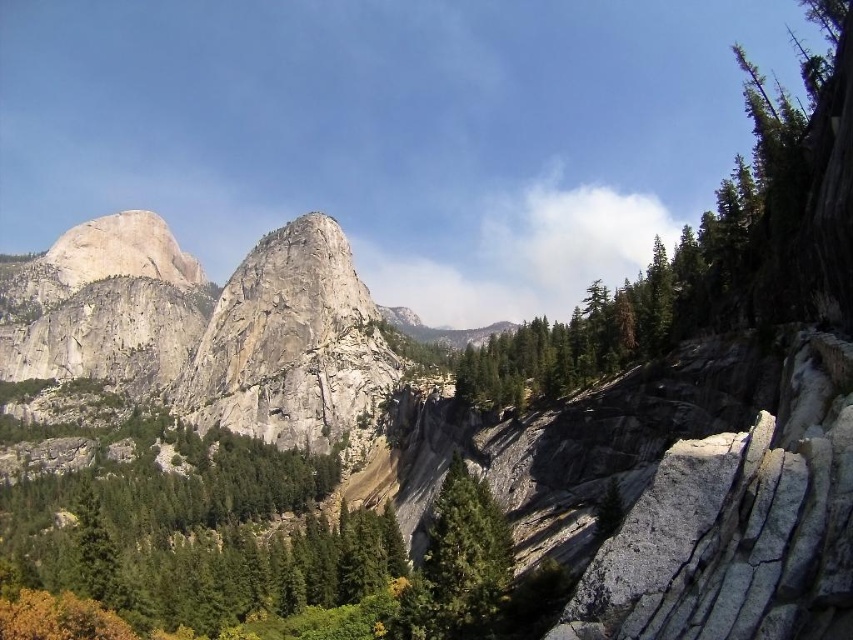
Question: Can you confirm if green textured rock at upper right is positioned to the right of gray/rough rock formation at center?

Choices:
 (A) yes
 (B) no

Answer: (A)

Question: Can you confirm if gray/rough rock formation at center is positioned below green textured tree at center?

Choices:
 (A) yes
 (B) no

Answer: (B)

Question: Which point is farther to the camera?

Choices:
 (A) gray/rough rock formation at center
 (B) green textured rock at upper right

Answer: (A)

Question: Which point is closer to the camera?

Choices:
 (A) 448,484
 (B) 505,397

Answer: (A)

Question: Among these objects, which one is nearest to the camera?

Choices:
 (A) green textured tree at center
 (B) gray/rough rock formation at center
 (C) green textured rock at upper right

Answer: (A)

Question: Is green textured rock at upper right in front of gray/rough rock formation at center?

Choices:
 (A) yes
 (B) no

Answer: (A)